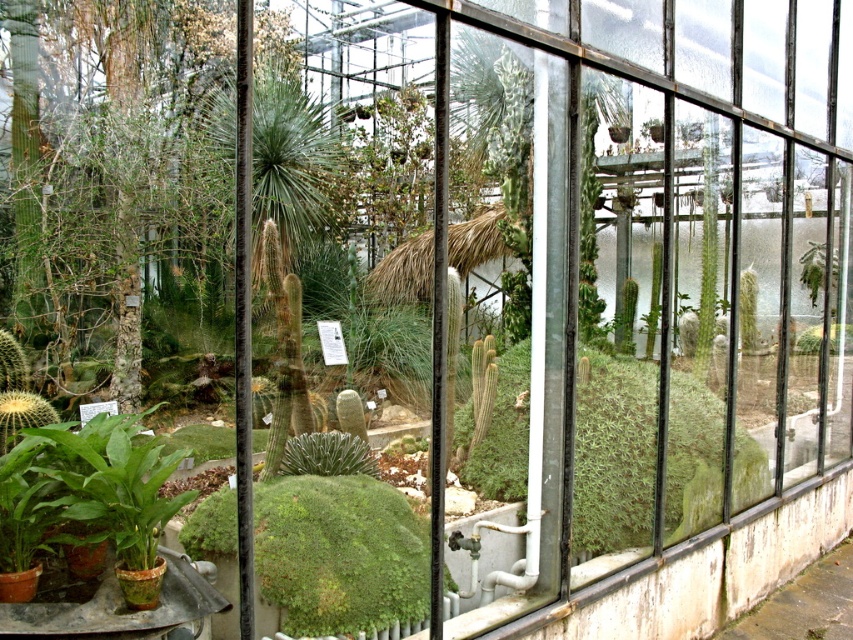
Does green fuzzy cactus at center appear on the left side of green fuzzy cactus at right?

Indeed, green fuzzy cactus at center is positioned on the left side of green fuzzy cactus at right.

Which is in front, point (339, 461) or point (811, 296)?

Point (339, 461) is more forward.

Identify the location of green fuzzy cactus at center. (328, 454).